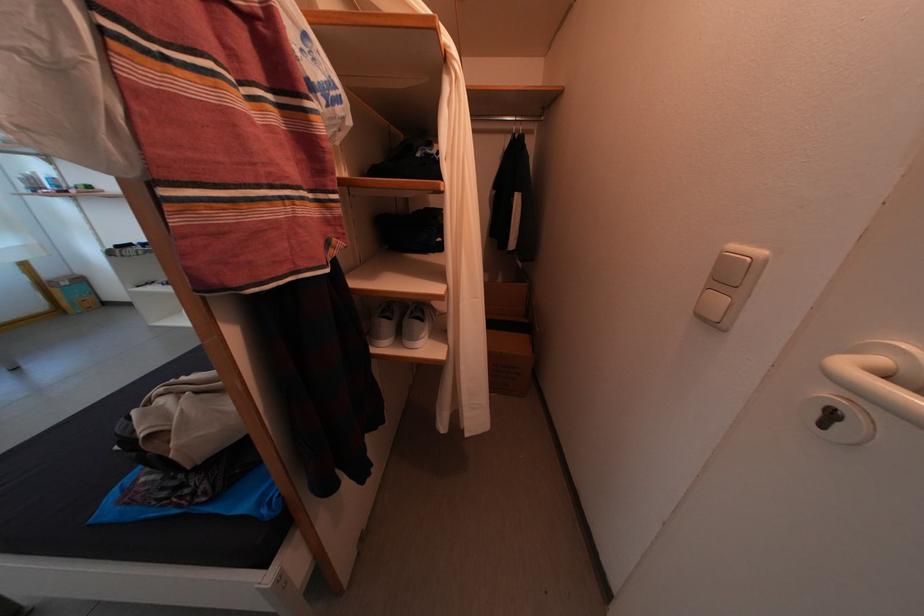
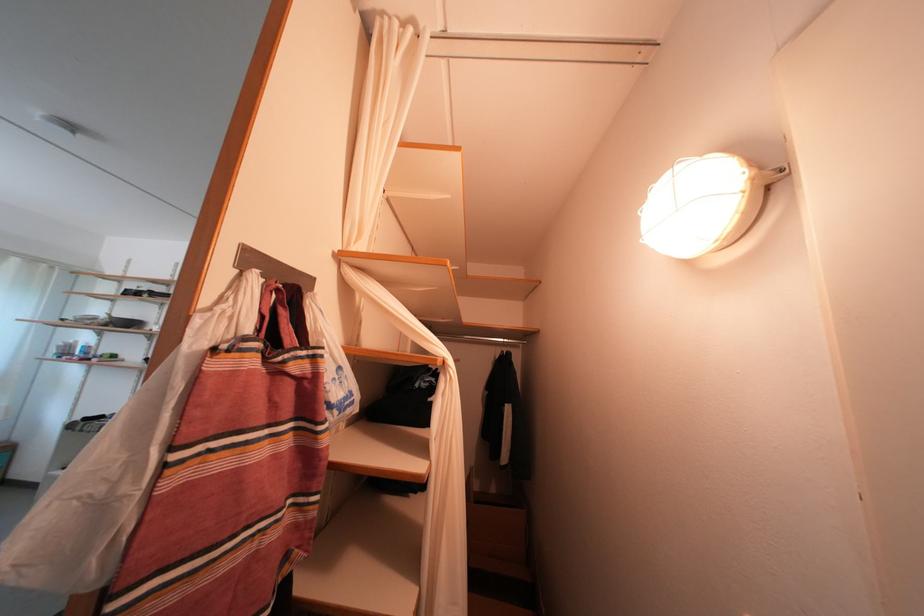
Question: Based on the continuous images, in which direction is the camera rotating? Reply with the corresponding letter.

Choices:
 (A) Left
 (B) Right
 (C) Up
 (D) Down

Answer: (C)